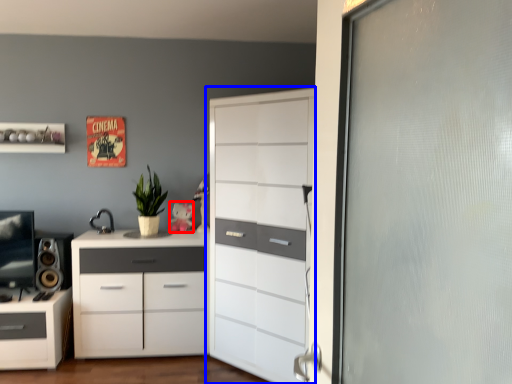
Question: Which point is further to the camera, toy (highlighted by a red box) or chest of drawers (highlighted by a blue box)?

Choices:
 (A) toy
 (B) chest of drawers

Answer: (A)